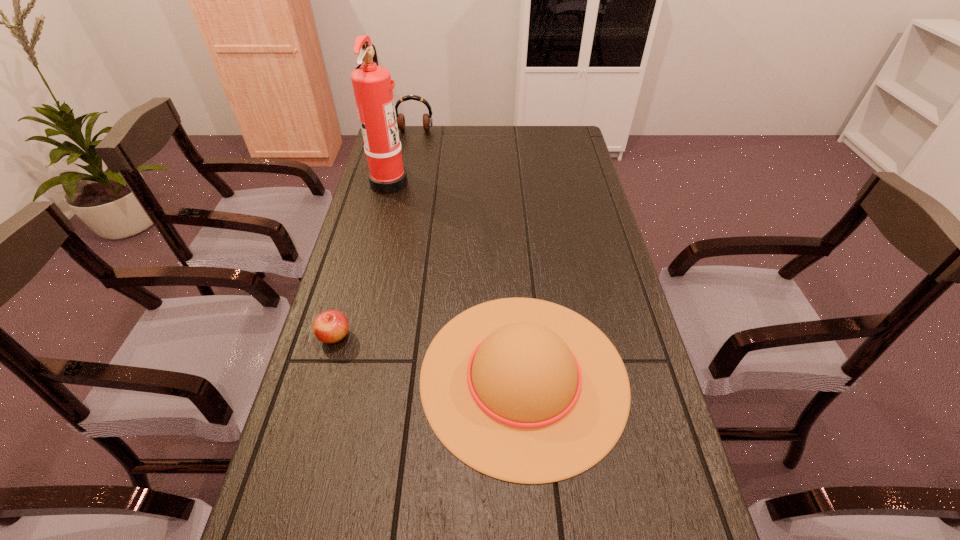
The height and width of the screenshot is (540, 960). In order to click on vacant space that satisfies the following two spatial constraints: 1. on the ear cup of the second shortest object; 2. on the left side of the second tallest object in this screenshot , I will do `click(364, 376)`.

Where is `free point that satisfies the following two spatial constraints: 1. on the ear cup of the headset; 2. at the nozzle of the tallest object`? The width and height of the screenshot is (960, 540). free point that satisfies the following two spatial constraints: 1. on the ear cup of the headset; 2. at the nozzle of the tallest object is located at coordinates (404, 182).